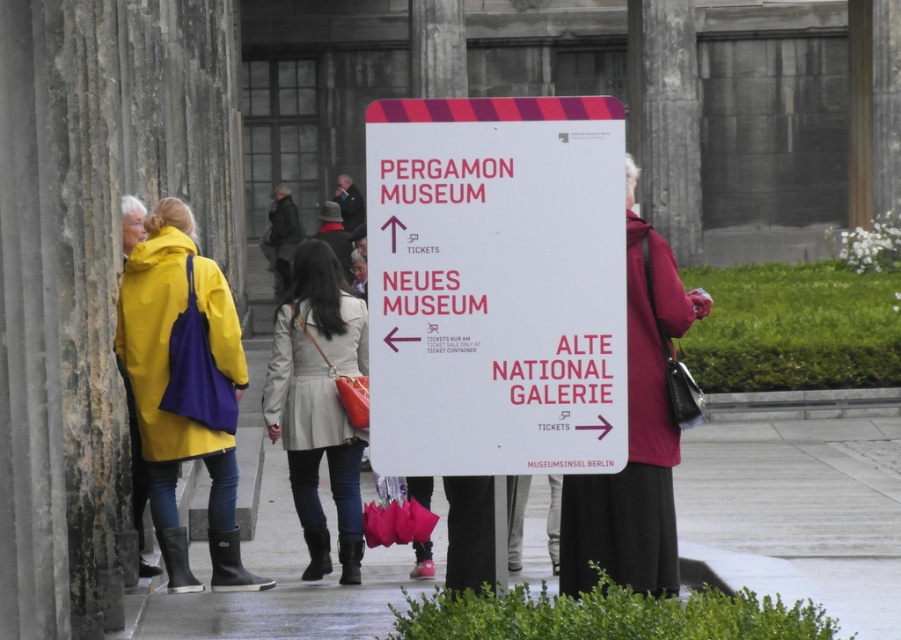
You are a visitor at the museum entrance and notice a white paper sign at center and a light beige leather coat at center. Which object is taller?

The white paper sign at center is taller than the light beige leather coat at center.

You are a visitor at the museum entrance and want to check the directions on the white paper sign at center. However, you notice a light beige leather coat at center blocking your view. Is the sign visible to you?

The white paper sign at center is above the light beige leather coat at center, so the sign should still be visible above the coat.

You are standing at the entrance of the museum complex and see the white paper sign at center and the light beige leather coat at center. If you want to reach the sign first before the coat, which direction should you move?

The white paper sign at center is 7.14 meters away from light beige leather coat at center. Since you want to reach the sign first, you should move towards the white paper sign at center, which is closer to your current position than the light beige leather coat at center.